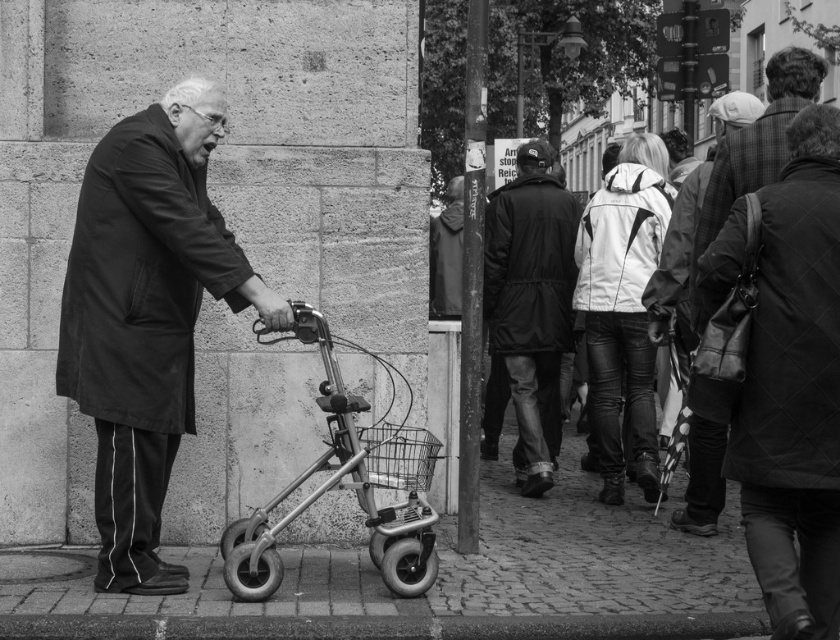
Question: Is dark fabric coat at center bigger than dark gray fabric coat at center?

Choices:
 (A) no
 (B) yes

Answer: (B)

Question: Which point appears closest to the camera in this image?

Choices:
 (A) (108, 397)
 (B) (520, 266)

Answer: (A)

Question: Which of the following is the closest to the observer?

Choices:
 (A) dark gray fabric coat at center
 (B) dark quilted jacket at center
 (C) leather jacket at center
 (D) metallic pavement at lower center

Answer: (B)

Question: Is the position of dark quilted jacket at center more distant than that of leather jacket at center?

Choices:
 (A) yes
 (B) no

Answer: (B)

Question: Which object is the closest to the metallic walker at center?

Choices:
 (A) leather jacket at center
 (B) dark quilted jacket at center
 (C) metallic pavement at lower center

Answer: (C)

Question: In this image, where is metallic walker at center located relative to metallic wire basket at lower center?

Choices:
 (A) left
 (B) right

Answer: (A)